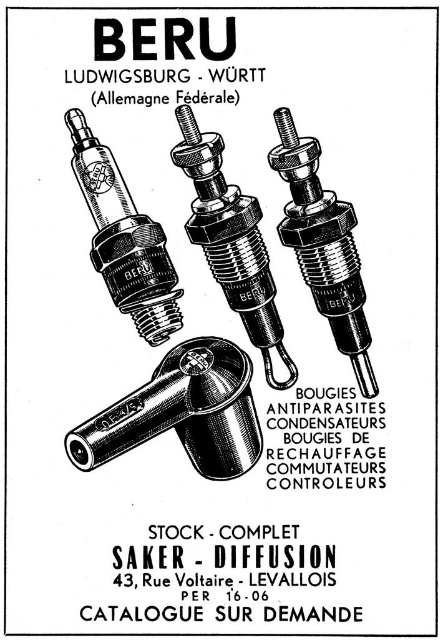
You are an automotive technician who needs to install a spark plug into an engine compartment that has limited space. The engine compartment can only accommodate a spark plug that is no wider than 3.5 inches. Based on the image, can you determine if either the metallic silver spark plug at center or the matte silver spark plug at center will fit in the space?

The metallic silver spark plug at center and matte silver spark plug at center are 3.73 inches apart. Since the required maximum width is 3.5 inches and the distance between them is 3.73 inches, neither of the spark plugs will fit in the space.